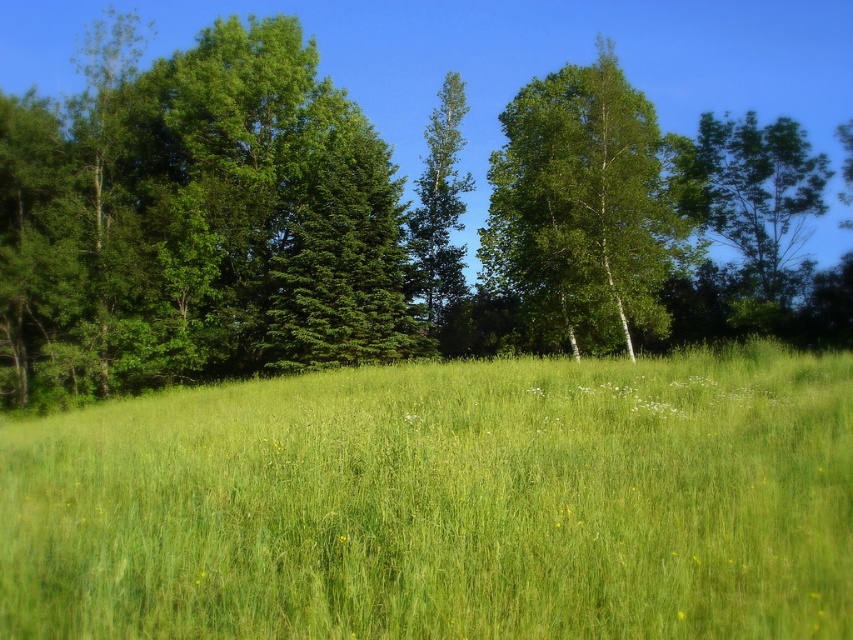
Question: Is green leafy tree at upper center to the right of green leafy tree at upper right from the viewer's perspective?

Choices:
 (A) no
 (B) yes

Answer: (A)

Question: Which point appears closest to the camera in this image?

Choices:
 (A) (616, 225)
 (B) (544, 400)
 (C) (730, 211)

Answer: (B)

Question: Which point is closer to the camera?

Choices:
 (A) green leafy tree at upper right
 (B) green leafy tree at center

Answer: (A)

Question: Which point is farther to the camera?

Choices:
 (A) (264, 150)
 (B) (569, 104)

Answer: (A)

Question: Can you confirm if green leafy tree at upper right is smaller than green leafy tree at center?

Choices:
 (A) yes
 (B) no

Answer: (B)

Question: Can you confirm if green grassy field at center is smaller than green bark tree at right?

Choices:
 (A) yes
 (B) no

Answer: (A)